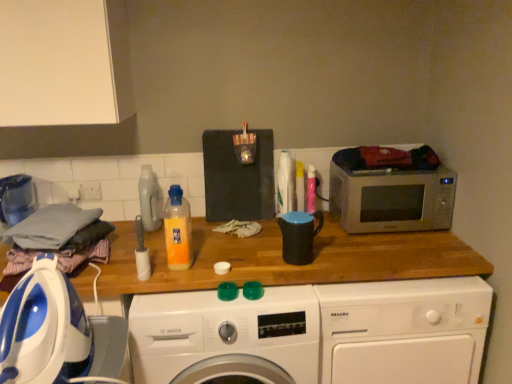
Question: In terms of width, does translucent orange liquid at center, the 1th bottle from the front, look wider or thinner when compared to black matte mug at center, which is counted as the 2th appliance, starting from the left?

Choices:
 (A) wide
 (B) thin

Answer: (B)

Question: Does point (177, 225) appear closer or farther from the camera than point (303, 230)?

Choices:
 (A) farther
 (B) closer

Answer: (A)

Question: Considering the real-world distances, which object is farthest from the silver metallic microwave at right?

Choices:
 (A) blue/white plastic iron at left, which is the first washing machine from left to right
 (B) black matte mug at center, which appears as the 1th appliance when viewed from the right
 (C) white plastic washing machine at center, which is counted as the first washing machine, starting from the right
 (D) white plastic washing machine at center, the second washing machine from the left
 (E) translucent orange liquid at center, which is the second bottle from left to right

Answer: (A)

Question: Estimate the real-world distances between objects in this image. Which object is closer to the blue/white plastic iron at left, which is the first washing machine from left to right?

Choices:
 (A) black matte mug at center, which ranks as the first appliance in back-to-front order
 (B) translucent orange liquid at center, which is counted as the second bottle, starting from the back
 (C) white plastic washing machine at center, the third washing machine in the left-to-right sequence
 (D) silver metallic microwave at right
 (E) matte plastic detergent at center, which ranks as the first bottle in back-to-front order

Answer: (B)